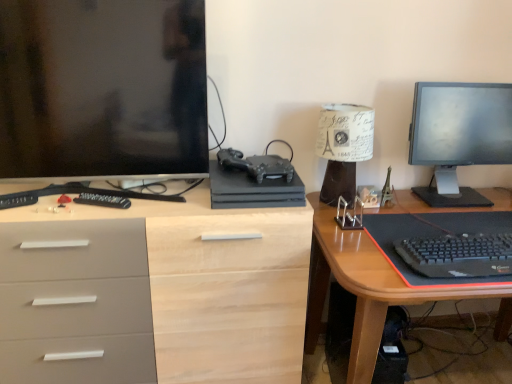
The image size is (512, 384). In order to click on vacant area on top of matte black gaming console at center (from a real-world perspective) in this screenshot , I will do `click(253, 170)`.